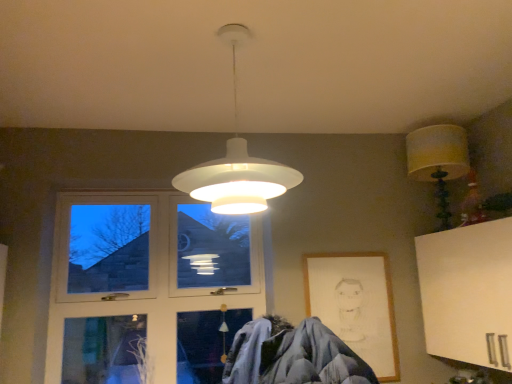
Question: Is white matte pendant light at center, which is the 2th lamp in back-to-front order, at the left side of wooden picture frame at lower right?

Choices:
 (A) no
 (B) yes

Answer: (B)

Question: Is white matte pendant light at center, placed as the second lamp when sorted from right to left, closer to camera compared to wooden picture frame at lower right?

Choices:
 (A) yes
 (B) no

Answer: (A)

Question: Does white matte pendant light at center, which is the 2th lamp in back-to-front order, have a greater height compared to wooden picture frame at lower right?

Choices:
 (A) yes
 (B) no

Answer: (B)

Question: Can you confirm if white matte pendant light at center, which is the 2th lamp in back-to-front order, is positioned to the right of wooden picture frame at lower right?

Choices:
 (A) no
 (B) yes

Answer: (A)

Question: From the image's perspective, is white matte pendant light at center, the first lamp from the front, beneath wooden picture frame at lower right?

Choices:
 (A) no
 (B) yes

Answer: (A)

Question: Can you confirm if white matte pendant light at center, positioned as the first lamp in left-to-right order, is wider than wooden picture frame at lower right?

Choices:
 (A) yes
 (B) no

Answer: (A)

Question: Does yellow fabric lampshade at upper right, the 1th lamp positioned from the back, turn towards wooden picture frame at lower right?

Choices:
 (A) yes
 (B) no

Answer: (B)

Question: Is yellow fabric lampshade at upper right, which is the 1th lamp in right-to-left order, positioned with its back to wooden picture frame at lower right?

Choices:
 (A) no
 (B) yes

Answer: (A)

Question: From a real-world perspective, is yellow fabric lampshade at upper right, the second lamp when ordered from front to back, under wooden picture frame at lower right?

Choices:
 (A) no
 (B) yes

Answer: (A)

Question: From a real-world perspective, is yellow fabric lampshade at upper right, the 1th lamp positioned from the back, positioned over wooden picture frame at lower right based on gravity?

Choices:
 (A) yes
 (B) no

Answer: (A)

Question: Does yellow fabric lampshade at upper right, which appears as the second lamp when viewed from the left, have a lesser width compared to wooden picture frame at lower right?

Choices:
 (A) no
 (B) yes

Answer: (A)

Question: Can you confirm if yellow fabric lampshade at upper right, the 1th lamp positioned from the back, is wider than wooden picture frame at lower right?

Choices:
 (A) yes
 (B) no

Answer: (A)

Question: Is wooden picture frame at lower right at the left side of clear glass window at left?

Choices:
 (A) yes
 (B) no

Answer: (B)